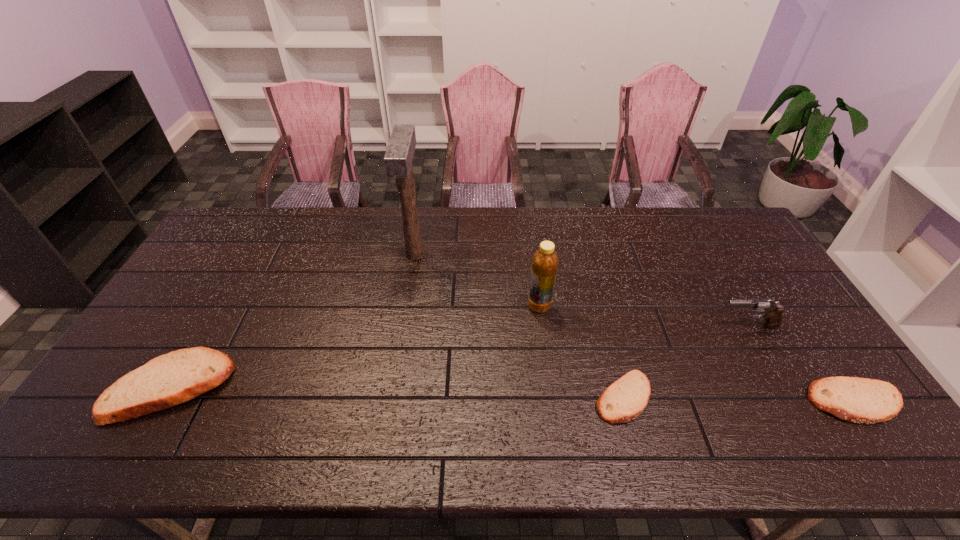
You are a GUI agent. You are given a task and a screenshot of the screen. Output one action in this format:
    pyautogui.click(x=<x>, y=<y>)
    Task: Click on the object located in the far edge section of the desktop
    The width and height of the screenshot is (960, 540).
    Given the screenshot: What is the action you would take?
    pyautogui.click(x=398, y=158)

Locate an element on the screen. object situated at the left edge is located at coordinates (174, 378).

Where is `pita bread at the right edge`? The height and width of the screenshot is (540, 960). pita bread at the right edge is located at coordinates (858, 400).

This screenshot has width=960, height=540. I want to click on pistol positioned at the right edge, so click(x=771, y=312).

You are a GUI agent. You are given a task and a screenshot of the screen. Output one action in this format:
    pyautogui.click(x=<x>, y=<y>)
    Task: Click on the object positioned at the near left corner
    
    Given the screenshot: What is the action you would take?
    pyautogui.click(x=174, y=378)

Identify the location of object situated at the near right corner. The height and width of the screenshot is (540, 960). coord(858,400).

I want to click on free space at the far edge of the desktop, so click(x=618, y=240).

Identify the location of vacant region at the near edge. (662, 410).

You are a GUI agent. You are given a task and a screenshot of the screen. Output one action in this format:
    pyautogui.click(x=<x>, y=<y>)
    Task: Click on the vacant space at the left edge
    
    Given the screenshot: What is the action you would take?
    pyautogui.click(x=244, y=254)

Find the location of a particular element. free space at the right edge of the desktop is located at coordinates (791, 302).